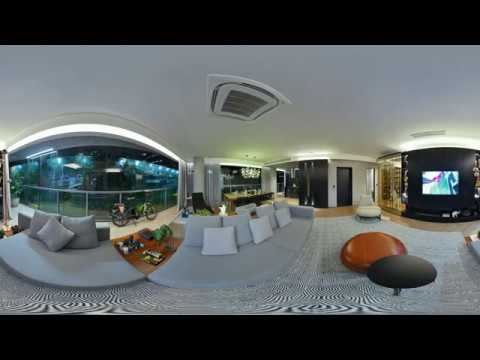
At what (x,y) coordinates should I click in order to perform the action: click on sofa. Please return your answer as a coordinate pair (x, y). This screenshot has height=360, width=480. Looking at the image, I should click on (258, 261).